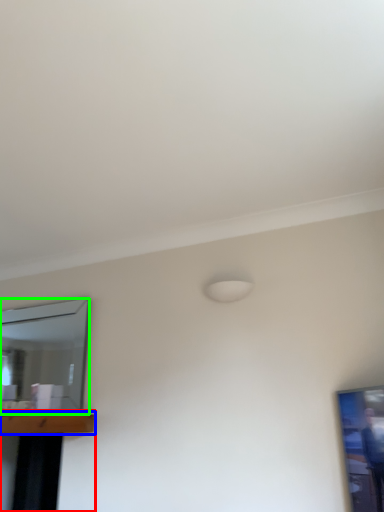
Question: Which object is the farthest from table (highlighted by a red box)? Choose among these: table (highlighted by a blue box) or mirror (highlighted by a green box).

Choices:
 (A) table
 (B) mirror

Answer: (B)